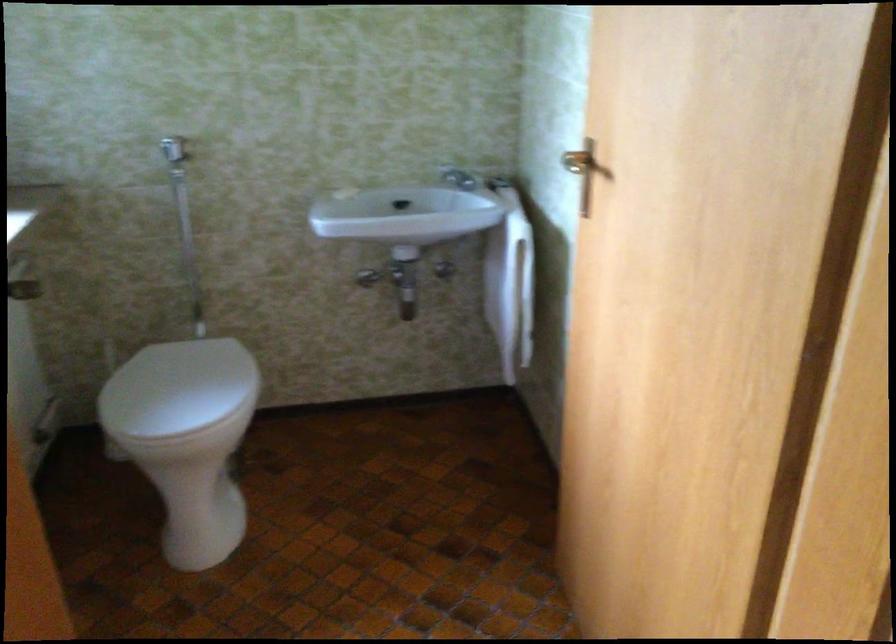
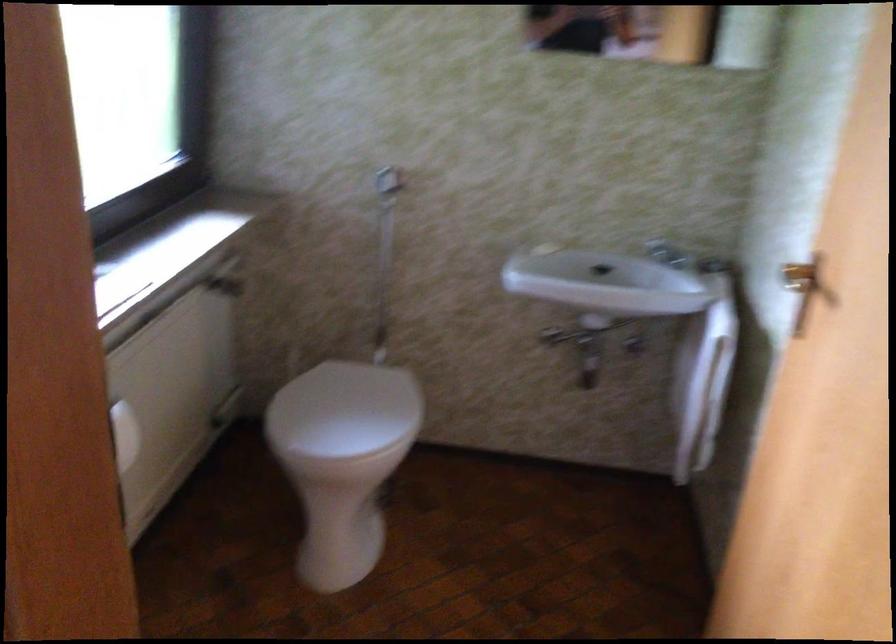
Question: What movement of the cameraman would produce the second image?

Choices:
 (A) Left
 (B) Right
 (C) Forward
 (D) Backward

Answer: (C)